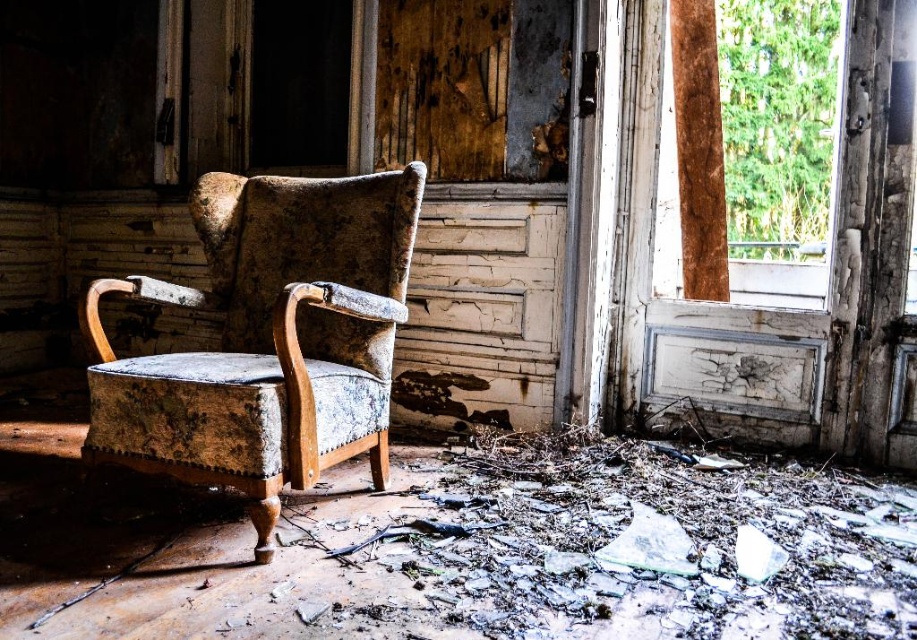
You are a restoration expert assessing the damage in this abandoned space. You need to move a tool from the distressed velvet armchair at center to the wooden frame at right. In which direction should you move the tool?

The distressed velvet armchair at center is to the left of the wooden frame at right, so you should move the tool to the right direction towards the wooden frame at right.

You are standing at the entrance of this abandoned room and see two points marked on the floor. The first point is at coordinate point (210, 305) and the second is at point (824, 198). Which point is closer to you as you stand at the entrance?

Point (210, 305) is in front of point (824, 198), so it is closer to you as you stand at the entrance.

You are a contractor assessing the abandoned space. You see the distressed velvet armchair at center and the wooden frame at right. Which object is shorter in height?

The distressed velvet armchair at center is shorter in height compared to the wooden frame at right.